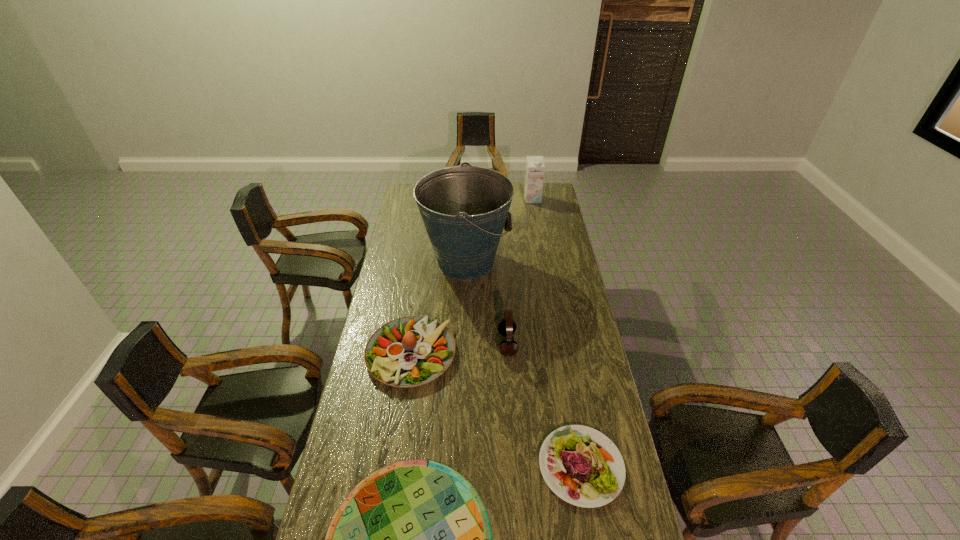
You are a GUI agent. You are given a task and a screenshot of the screen. Output one action in this format:
    pyautogui.click(x=<x>, y=<y>)
    Task: Click on the bucket
    This screenshot has height=540, width=960.
    Given the screenshot: What is the action you would take?
    pyautogui.click(x=464, y=209)

Locate an element on the screen. the tallest object is located at coordinates (464, 209).

Image resolution: width=960 pixels, height=540 pixels. In order to click on the fifth shortest object in this screenshot , I will do `click(534, 177)`.

Identify the location of the farthest object. (534, 177).

The width and height of the screenshot is (960, 540). I want to click on headset, so click(507, 326).

Locate an element on the screen. The image size is (960, 540). the left salad plate is located at coordinates (410, 351).

You are a GUI agent. You are given a task and a screenshot of the screen. Output one action in this format:
    pyautogui.click(x=<x>, y=<y>)
    Task: Click on the third shortest object
    
    Given the screenshot: What is the action you would take?
    pyautogui.click(x=410, y=351)

This screenshot has width=960, height=540. What are the coordinates of `the shorter salad plate` in the screenshot? It's located at (582, 466).

The width and height of the screenshot is (960, 540). What are the coordinates of `the fifth tallest object` in the screenshot? It's located at (582, 466).

The width and height of the screenshot is (960, 540). I want to click on blank space located 0.290m with the handle on opposite sides of the second farthest object, so click(x=569, y=262).